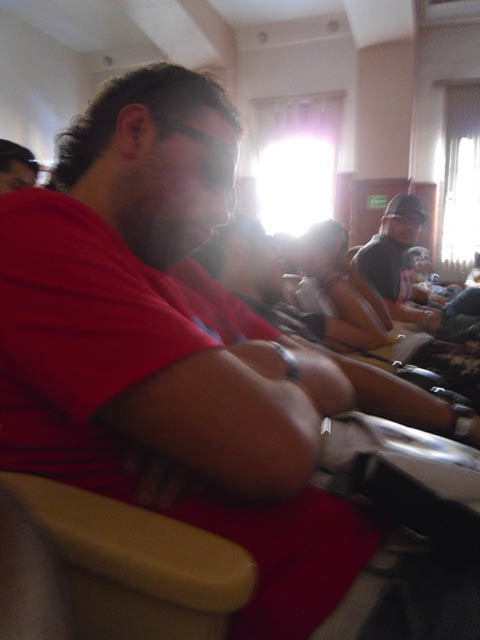
You are a photographer trying to capture a clear shot of the dark gray cap at upper right and the matte red shirt at center. Based on their sizes in the image, which object would require you to zoom in more to fill the frame?

The dark gray cap at upper right is bigger than the matte red shirt at center, so you would need to zoom in more on the matte red shirt at center to fill the frame since it is smaller.